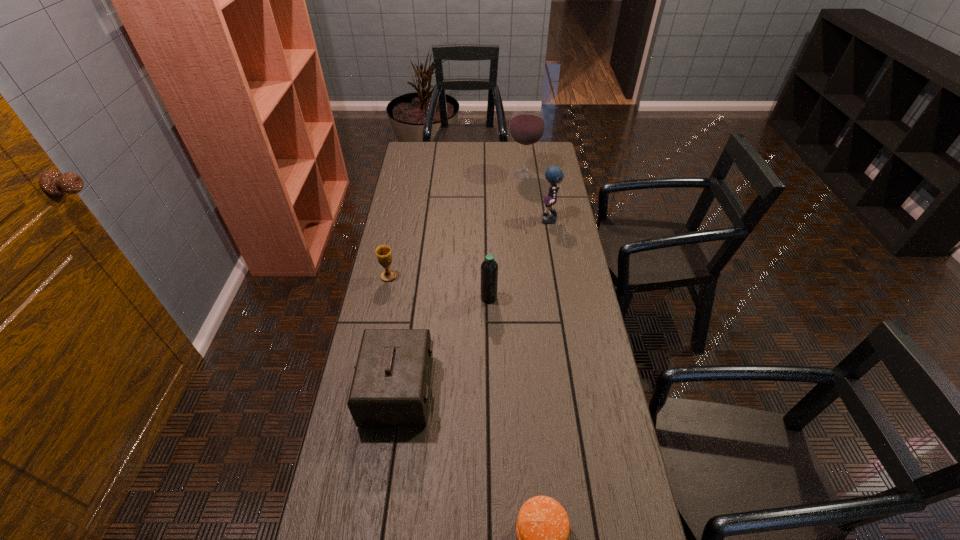
This screenshot has height=540, width=960. I want to click on alcohol, so click(527, 125).

At what (x,y) coordinates should I click in order to perform the action: click on the farthest object. Please return your answer as a coordinate pair (x, y). Looking at the image, I should click on (527, 125).

Locate an element on the screen. rag doll is located at coordinates (553, 174).

The width and height of the screenshot is (960, 540). Find the location of `the second tallest object`. the second tallest object is located at coordinates (553, 174).

Locate an element on the screen. Image resolution: width=960 pixels, height=540 pixels. the fourth object from right to left is located at coordinates (489, 268).

Locate an element on the screen. This screenshot has height=540, width=960. the third nearest object is located at coordinates (489, 268).

This screenshot has height=540, width=960. In order to click on the first-aid kit in this screenshot , I will do `click(390, 388)`.

The width and height of the screenshot is (960, 540). Identify the location of the third shortest object. (390, 388).

You are a GUI agent. You are given a task and a screenshot of the screen. Output one action in this format:
    pyautogui.click(x=<x>, y=<y>)
    Task: Click on the third farthest object
    The image size is (960, 540).
    Given the screenshot: What is the action you would take?
    pyautogui.click(x=383, y=252)

Locate an element on the screen. chalice is located at coordinates (383, 252).